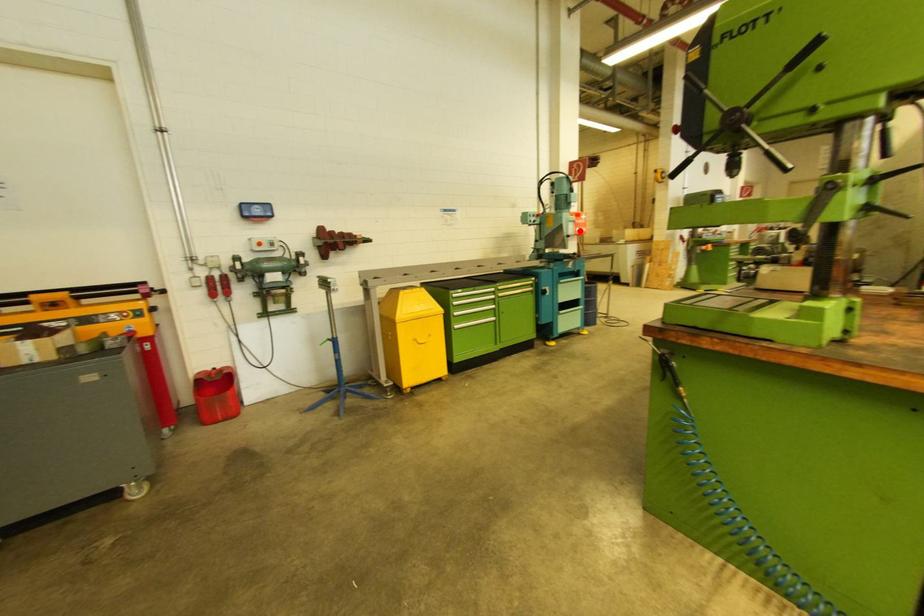
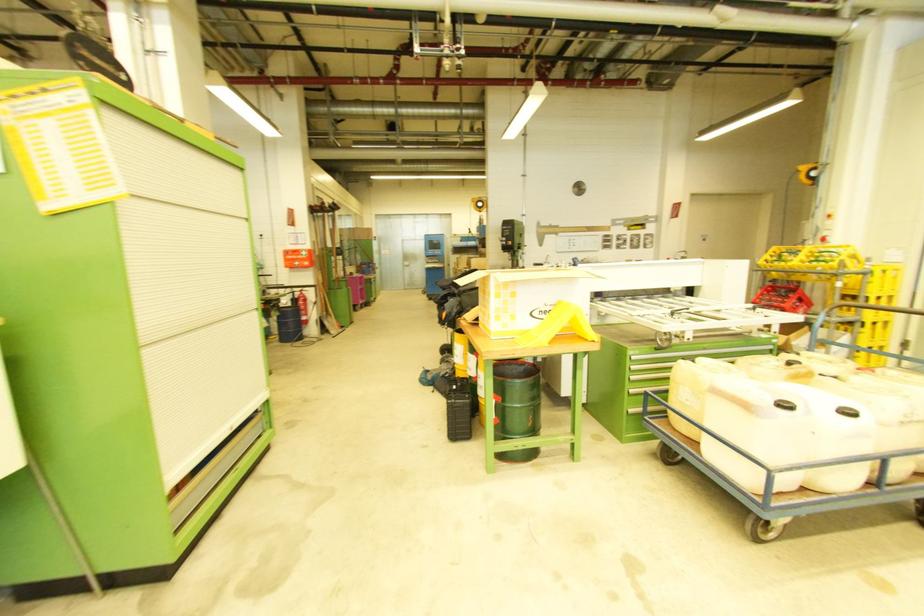
Locate, in the second image, the point that corresponds to the highlighted location in the first image.

(299, 265)